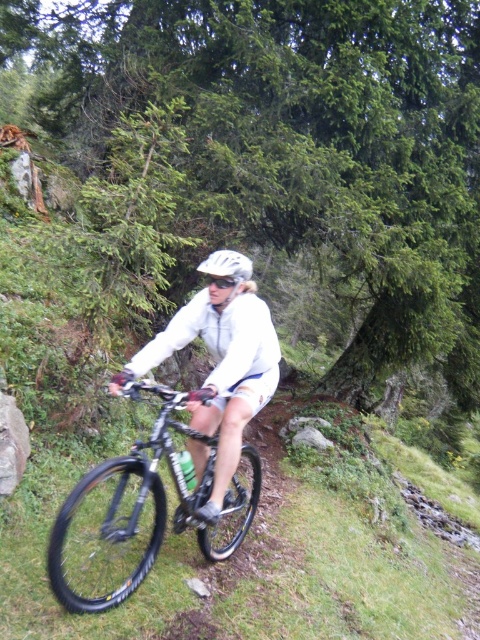
Is white matte bicycle helmet at center to the right of transparent plastic goggles at center from the viewer's perspective?

Correct, you'll find white matte bicycle helmet at center to the right of transparent plastic goggles at center.

Is point (251, 276) closer to camera compared to point (211, 280)?

No, (251, 276) is behind (211, 280).

Describe the element at coordinates (227, 266) in the screenshot. I see `white matte bicycle helmet at center` at that location.

Identify the location of white matte bicycle helmet at center. Image resolution: width=480 pixels, height=640 pixels. (227, 266).

In the scene shown: Who is higher up, shiny metallic bicycle at center or white matte bicycle helmet at center?

white matte bicycle helmet at center

Is point (134, 444) less distant than point (237, 273)?

No, it is not.

The height and width of the screenshot is (640, 480). I want to click on shiny metallic bicycle at center, so click(153, 499).

Who is positioned more to the right, shiny metallic bicycle at center or transparent plastic goggles at center?

From the viewer's perspective, transparent plastic goggles at center appears more on the right side.

The image size is (480, 640). I want to click on shiny metallic bicycle at center, so click(x=153, y=499).

Find the location of `shiny metallic bicycle at center`. shiny metallic bicycle at center is located at coordinates (153, 499).